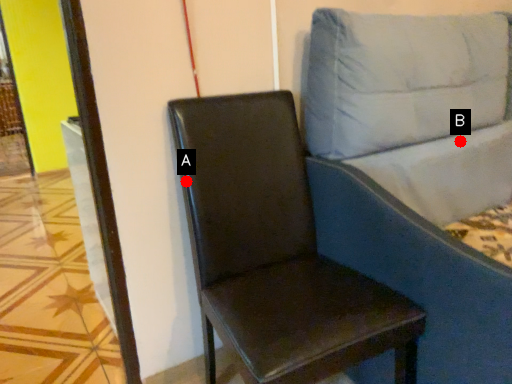
Question: Two points are circled on the image, labeled by A and B beside each circle. Which point is farther from the camera taking this photo?

Choices:
 (A) A is further
 (B) B is further

Answer: (B)